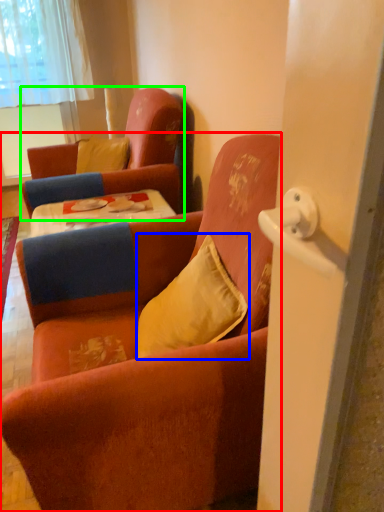
Question: Which is nearer to the chair (highlighted by a red box)? pillow (highlighted by a blue box) or chair (highlighted by a green box).

Choices:
 (A) pillow
 (B) chair

Answer: (A)